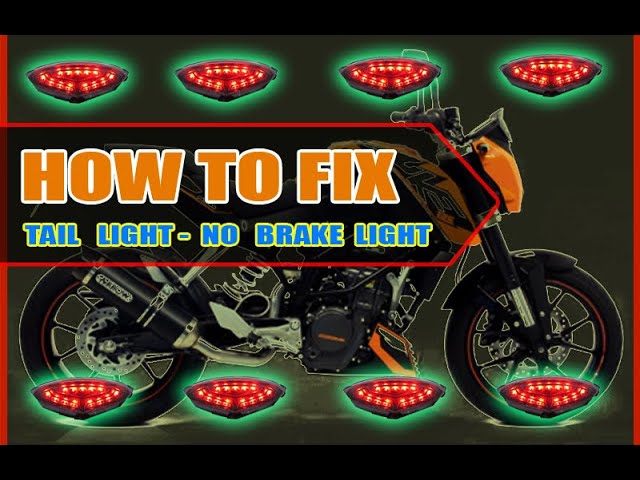
You are a GUI agent. You are given a task and a screenshot of the screen. Output one action in this format:
    pyautogui.click(x=<x>, y=<y>)
    Task: Click on the footrest
    Image resolution: width=640 pixels, height=480 pixels.
    Given the screenshot: What is the action you would take?
    [x=396, y=352]